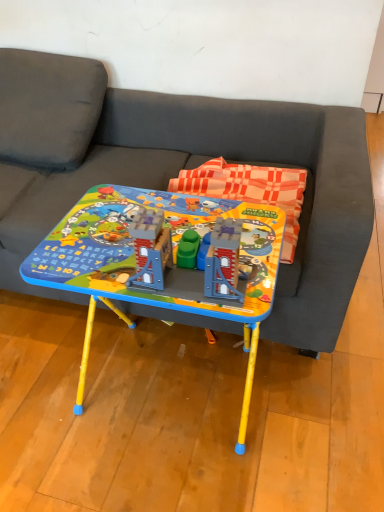
Locate an element on the screen. The width and height of the screenshot is (384, 512). free space in front of matte plastic table at center is located at coordinates (160, 472).